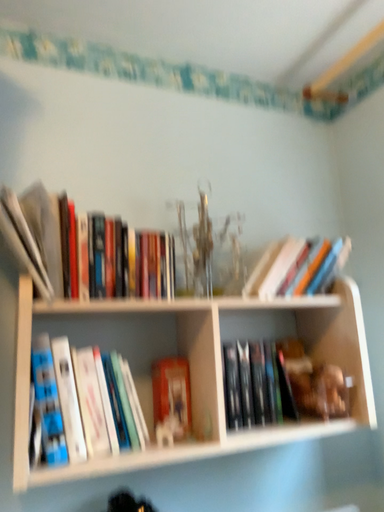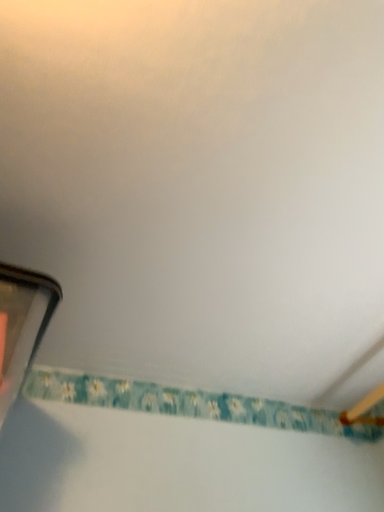
Question: Which way did the camera rotate in the video?

Choices:
 (A) rotated downward
 (B) rotated upward

Answer: (B)